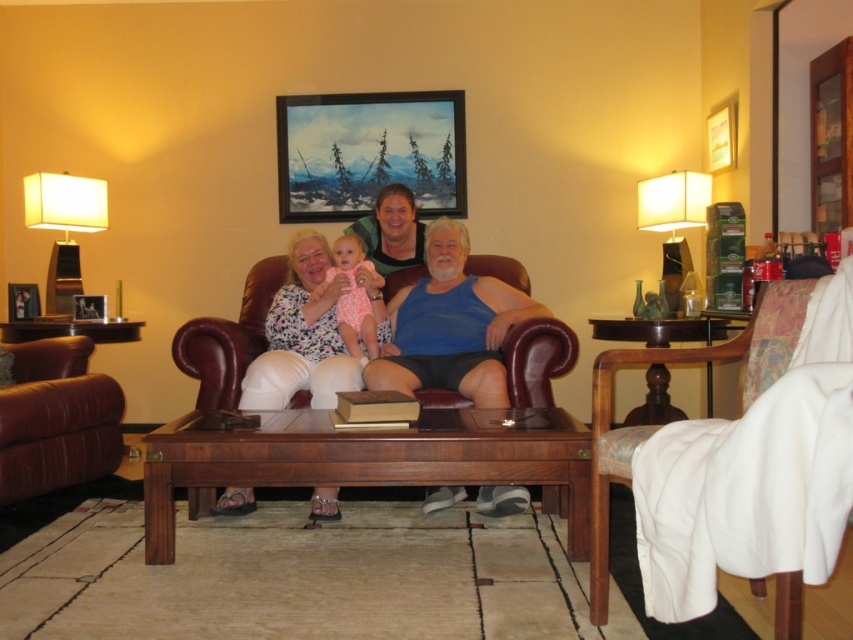
You are sitting on the couch across from the coffee table and want to reach both the painted wood picture frame at upper center and the white fabric lampshade at left. Which object will require you to stretch your hand further to reach?

The white fabric lampshade at left is further away from you than the painted wood picture frame at upper center, so you will need to stretch your hand further to reach the white fabric lampshade at left.

You are a guest in the living room and want to admire the brushed metal picture frame at upper left. Which direction should you move relative to the matte blue tank top at center to reach it?

The brushed metal picture frame at upper left is to the left of the matte blue tank top at center, so you should move to the left relative to the matte blue tank top at center to reach it.